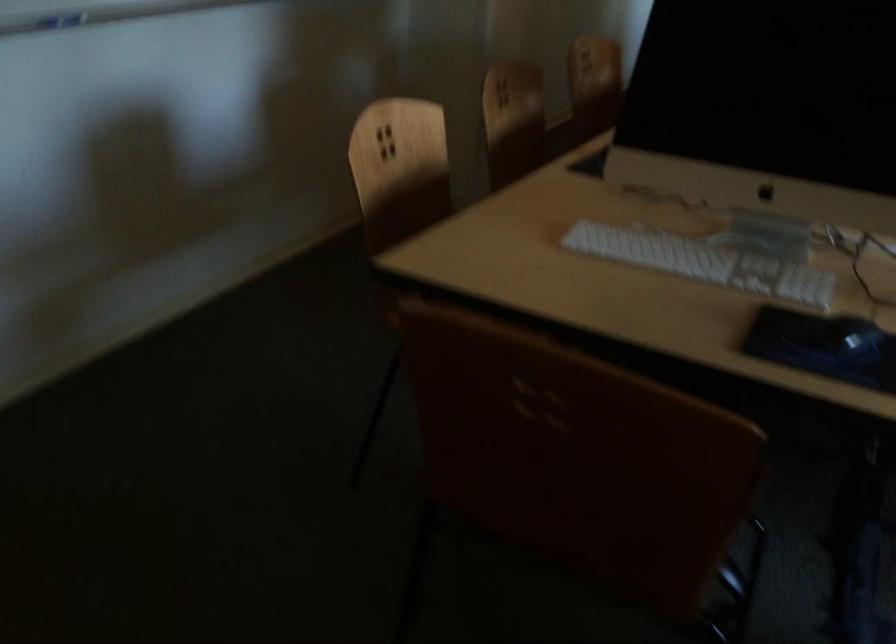
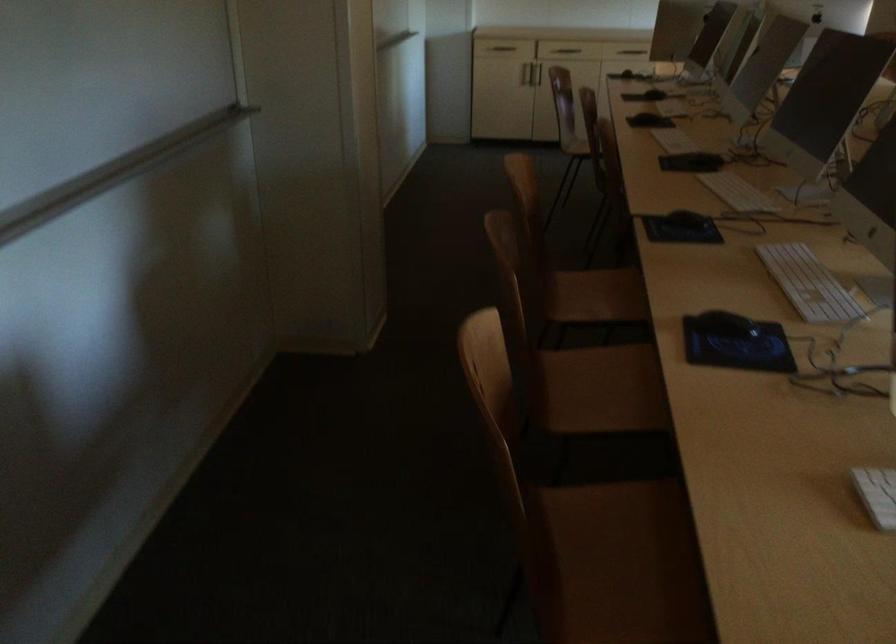
In a continuous first-person perspective shot, in which direction is the camera moving?

The cameraman walked toward left, forward.